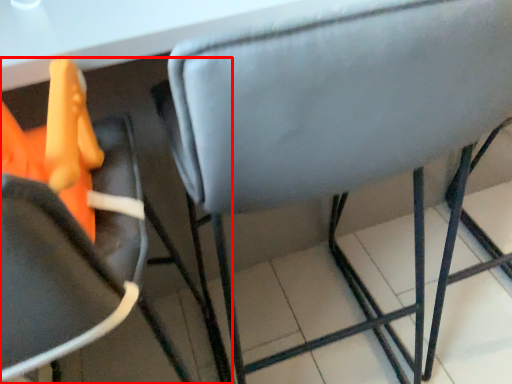
Question: From the image, what is the correct spatial relationship of chair (annotated by the red box) in relation to chair?

Choices:
 (A) right
 (B) left

Answer: (B)